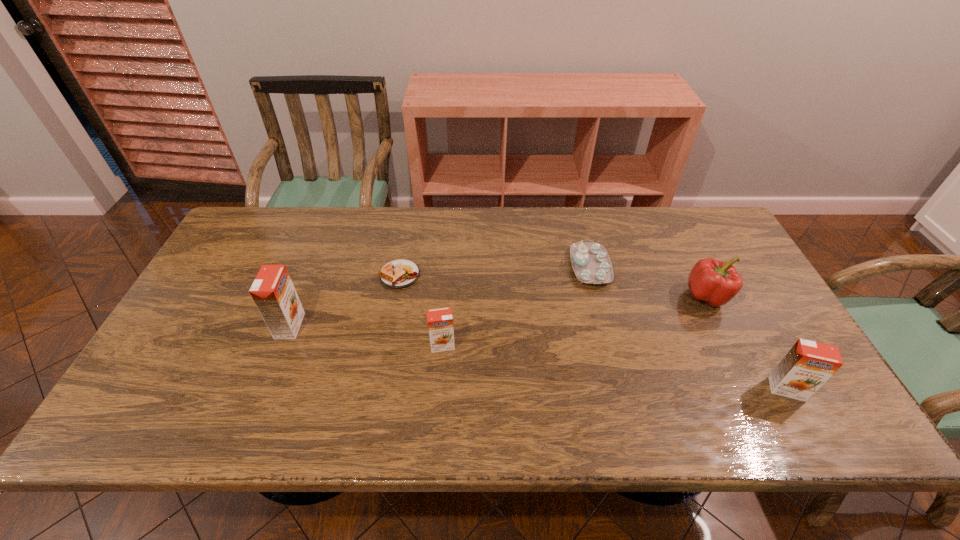
Locate which orange juice ranks in proximity to the bell pepper. Please provide its 2D coordinates. Your answer should be formatted as a tuple, i.e. [(x, y)], where the tuple contains the x and y coordinates of a point satisfying the conditions above.

[(807, 366)]

Select which orange juice appears as the third closest to the bell pepper. Please provide its 2D coordinates. Your answer should be formatted as a tuple, i.e. [(x, y)], where the tuple contains the x and y coordinates of a point satisfying the conditions above.

[(273, 292)]

You are a GUI agent. You are given a task and a screenshot of the screen. Output one action in this format:
    pyautogui.click(x=<x>, y=<y>)
    Task: Click on the vacant space that satisfies the following two spatial constraints: 1. on the back side of the bell pepper; 2. on the left side of the second orange juice from left to right
    This screenshot has height=540, width=960.
    Given the screenshot: What is the action you would take?
    pyautogui.click(x=446, y=296)

Where is `free spot that satisfies the following two spatial constraints: 1. on the front side of the fifth object from right to left; 2. on the right side of the second tallest orange juice`? The height and width of the screenshot is (540, 960). free spot that satisfies the following two spatial constraints: 1. on the front side of the fifth object from right to left; 2. on the right side of the second tallest orange juice is located at coordinates (379, 389).

Identify the location of free space in the image that satisfies the following two spatial constraints: 1. on the front side of the nearest orange juice; 2. on the right side of the bell pepper. This screenshot has height=540, width=960. (753, 389).